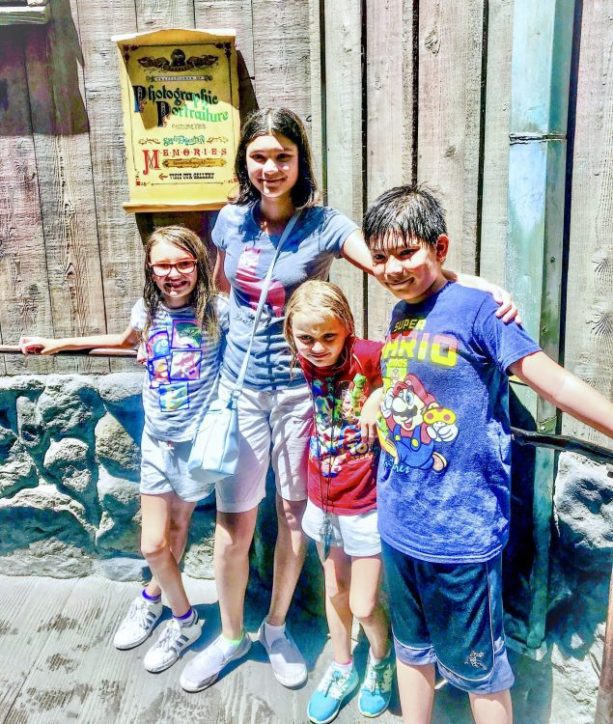
Locate an element on the screen. window is located at coordinates (16, 14).